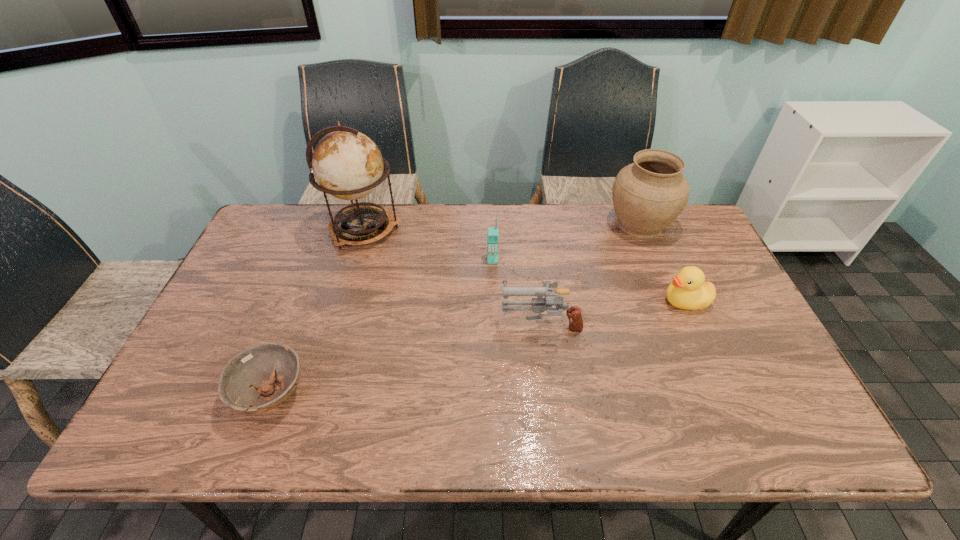
You are a GUI agent. You are given a task and a screenshot of the screen. Output one action in this format:
    pyautogui.click(x=<x>, y=<y>)
    Task: Click on the object that is at the near edge
    The width and height of the screenshot is (960, 540).
    Given the screenshot: What is the action you would take?
    pyautogui.click(x=252, y=372)

This screenshot has height=540, width=960. Identify the location of object positioned at the left edge. (252, 372).

Find the location of a particular element. urn located in the right edge section of the desktop is located at coordinates (649, 194).

Locate an element on the screen. This screenshot has height=540, width=960. duck situated at the right edge is located at coordinates tap(689, 290).

At what (x,y) coordinates should I click in order to perform the action: click on object that is at the near left corner. Please return your answer as a coordinate pair (x, y). This screenshot has height=540, width=960. Looking at the image, I should click on (252, 372).

You are a GUI agent. You are given a task and a screenshot of the screen. Output one action in this format:
    pyautogui.click(x=<x>, y=<y>)
    Task: Click on the object present at the far right corner
    The image size is (960, 540).
    Given the screenshot: What is the action you would take?
    (649, 194)

Where is `free location at the far edge`? free location at the far edge is located at coordinates (524, 218).

This screenshot has width=960, height=540. What are the coordinates of `blank space at the near edge of the desktop` in the screenshot? It's located at (560, 414).

The image size is (960, 540). Identify the location of free spot at the left edge of the desktop. (256, 324).

Locate an element on the screen. Image resolution: width=960 pixels, height=540 pixels. free space at the right edge is located at coordinates (684, 253).